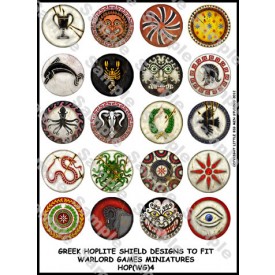
You are a GUI agent. You are given a task and a screenshot of the screen. Output one action in this format:
    pyautogui.click(x=<x>, y=<y>)
    Task: Click on the pot
    Image resolution: width=275 pixels, height=275 pixels.
    Given the screenshot: What is the action you would take?
    pyautogui.click(x=65, y=21)